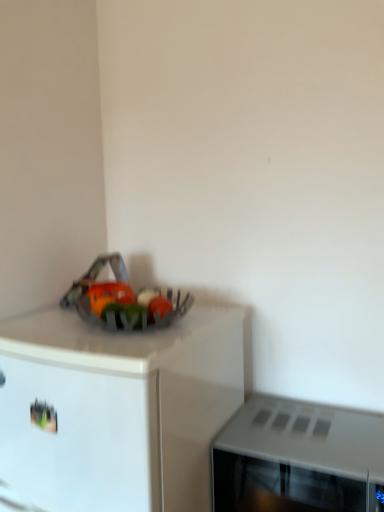
Identify the location of vacant area on top of gray matte microwave at right (from a real-world perspective). (311, 428).